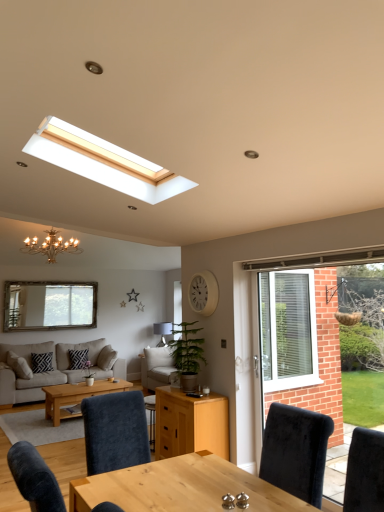
Question: Can you confirm if wooden table at center is smaller than black textured pillow at center, acting as the 1th pillow starting from the right?

Choices:
 (A) no
 (B) yes

Answer: (A)

Question: Is wooden table at center not close to black textured pillow at center, the second pillow viewed from the left?

Choices:
 (A) yes
 (B) no

Answer: (A)

Question: Is wooden table at center to the right of black textured pillow at center, acting as the 1th pillow starting from the right, from the viewer's perspective?

Choices:
 (A) yes
 (B) no

Answer: (A)

Question: From a real-world perspective, is wooden table at center located beneath black textured pillow at center, the second pillow viewed from the left?

Choices:
 (A) yes
 (B) no

Answer: (A)

Question: Is wooden table at center thinner than black textured pillow at center, the second pillow viewed from the left?

Choices:
 (A) no
 (B) yes

Answer: (A)

Question: From the image's perspective, is wooden table at center located beneath black textured pillow at center, the second pillow viewed from the left?

Choices:
 (A) no
 (B) yes

Answer: (A)

Question: Can you confirm if beige fabric couch at lower left is bigger than gold metallic chandelier at upper left?

Choices:
 (A) yes
 (B) no

Answer: (A)

Question: Is beige fabric couch at lower left positioned with its back to gold metallic chandelier at upper left?

Choices:
 (A) yes
 (B) no

Answer: (B)

Question: From a real-world perspective, is beige fabric couch at lower left on top of gold metallic chandelier at upper left?

Choices:
 (A) yes
 (B) no

Answer: (B)

Question: Does beige fabric couch at lower left appear on the right side of gold metallic chandelier at upper left?

Choices:
 (A) yes
 (B) no

Answer: (B)

Question: Does beige fabric couch at lower left have a greater width compared to gold metallic chandelier at upper left?

Choices:
 (A) no
 (B) yes

Answer: (B)

Question: Is there a large distance between beige fabric couch at lower left and gold metallic chandelier at upper left?

Choices:
 (A) no
 (B) yes

Answer: (B)

Question: Is black textured pillow at center, acting as the 1th pillow starting from the right, facing away from beige fabric couch at lower left?

Choices:
 (A) yes
 (B) no

Answer: (A)